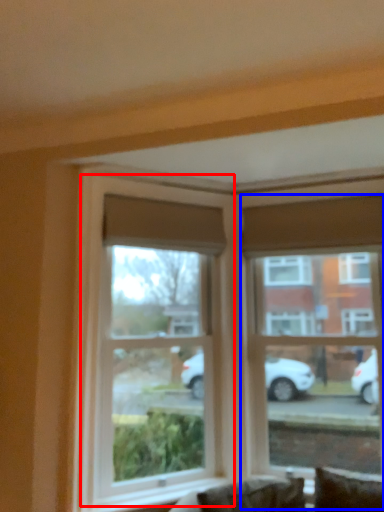
Question: Among these objects, which one is nearest to the camera, window (highlighted by a red box) or window (highlighted by a blue box)?

Choices:
 (A) window
 (B) window

Answer: (A)